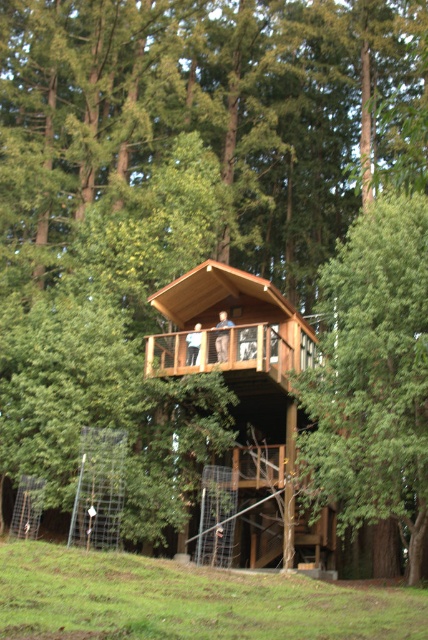
Question: Which point is farther to the camera?

Choices:
 (A) wooden cabin at center
 (B) green leafy tree at center

Answer: (A)

Question: Is green leafy tree at center further to the viewer compared to wooden cabin at center?

Choices:
 (A) no
 (B) yes

Answer: (A)

Question: Where is green leafy tree at center located in relation to wooden cabin at center in the image?

Choices:
 (A) below
 (B) above

Answer: (B)

Question: Is green leafy tree at center smaller than wooden cabin at center?

Choices:
 (A) yes
 (B) no

Answer: (B)